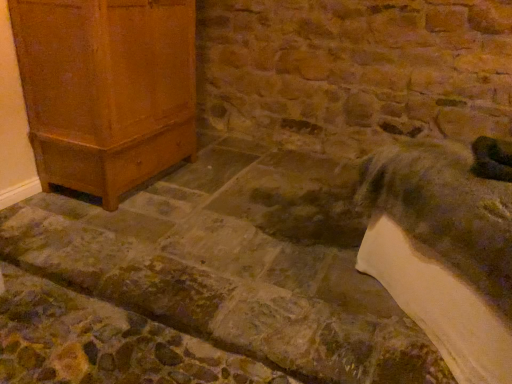
Question: Does matte wood cabinet at left have a smaller size compared to green fuzzy animal at lower right?

Choices:
 (A) yes
 (B) no

Answer: (B)

Question: Does matte wood cabinet at left come in front of green fuzzy animal at lower right?

Choices:
 (A) yes
 (B) no

Answer: (B)

Question: Is the depth of matte wood cabinet at left greater than that of green fuzzy animal at lower right?

Choices:
 (A) yes
 (B) no

Answer: (A)

Question: Is matte wood cabinet at left next to green fuzzy animal at lower right and touching it?

Choices:
 (A) yes
 (B) no

Answer: (B)

Question: Is matte wood cabinet at left not within green fuzzy animal at lower right?

Choices:
 (A) no
 (B) yes

Answer: (B)

Question: Can you confirm if matte wood cabinet at left is wider than green fuzzy animal at lower right?

Choices:
 (A) yes
 (B) no

Answer: (A)

Question: Is matte wood cabinet at left located within green fuzzy animal at lower right?

Choices:
 (A) no
 (B) yes

Answer: (A)

Question: Is green fuzzy animal at lower right looking in the opposite direction of matte wood cabinet at left?

Choices:
 (A) no
 (B) yes

Answer: (A)

Question: Can you confirm if green fuzzy animal at lower right is taller than matte wood cabinet at left?

Choices:
 (A) yes
 (B) no

Answer: (B)

Question: Is green fuzzy animal at lower right wider than matte wood cabinet at left?

Choices:
 (A) yes
 (B) no

Answer: (B)

Question: Is green fuzzy animal at lower right next to matte wood cabinet at left?

Choices:
 (A) yes
 (B) no

Answer: (B)

Question: From the image's perspective, is green fuzzy animal at lower right over matte wood cabinet at left?

Choices:
 (A) no
 (B) yes

Answer: (A)

Question: From the image's perspective, is matte wood cabinet at left positioned above or below green fuzzy animal at lower right?

Choices:
 (A) above
 (B) below

Answer: (A)